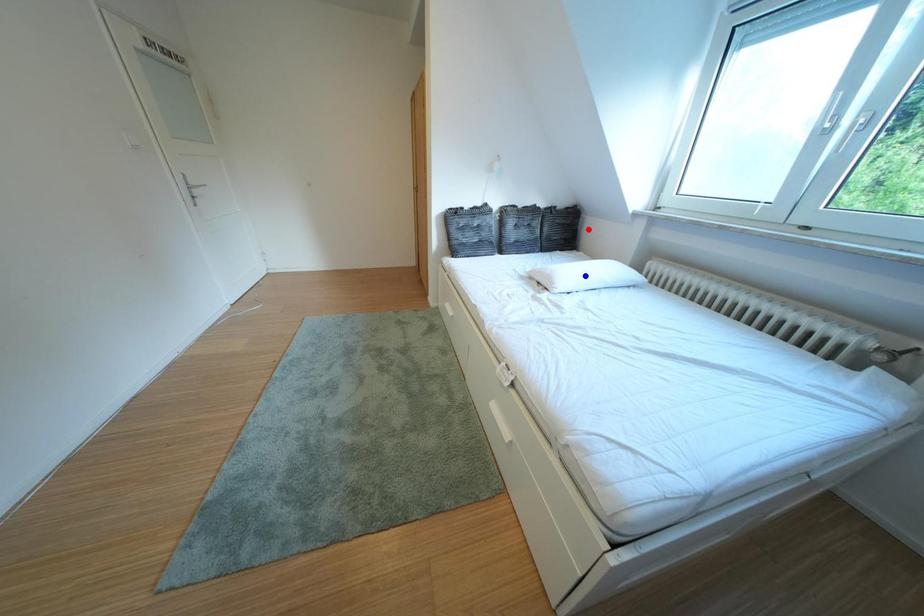
Question: Which of the two points in the image is closer to the camera?

Choices:
 (A) Blue point is closer.
 (B) Red point is closer.

Answer: (A)